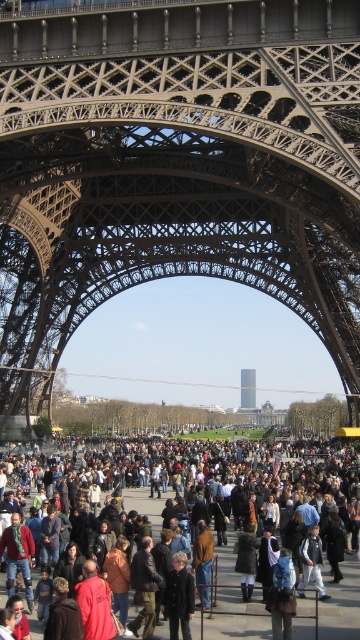
Question: Is dark brown leather jacket at lower center in front of smooth glass tower at center?

Choices:
 (A) yes
 (B) no

Answer: (A)

Question: Which of the following is the farthest from the observer?

Choices:
 (A) metallic lattice structure at center
 (B) smooth glass tower at center
 (C) dark brown leather jacket at lower center
 (D) dark brown leather coat at center

Answer: (B)

Question: Among these points, which one is nearest to the camera?

Choices:
 (A) (173, 579)
 (B) (82, 544)

Answer: (A)

Question: Considering the relative positions of dark brown leather jacket at lower center and smooth glass tower at center in the image provided, where is dark brown leather jacket at lower center located with respect to smooth glass tower at center?

Choices:
 (A) above
 (B) below

Answer: (B)

Question: Estimate the real-world distances between objects in this image. Which object is farther from the smooth glass tower at center?

Choices:
 (A) dark brown leather jacket at lower center
 (B) dark brown leather coat at center

Answer: (B)

Question: Is dark brown leather coat at center to the right of smooth glass tower at center from the viewer's perspective?

Choices:
 (A) yes
 (B) no

Answer: (B)